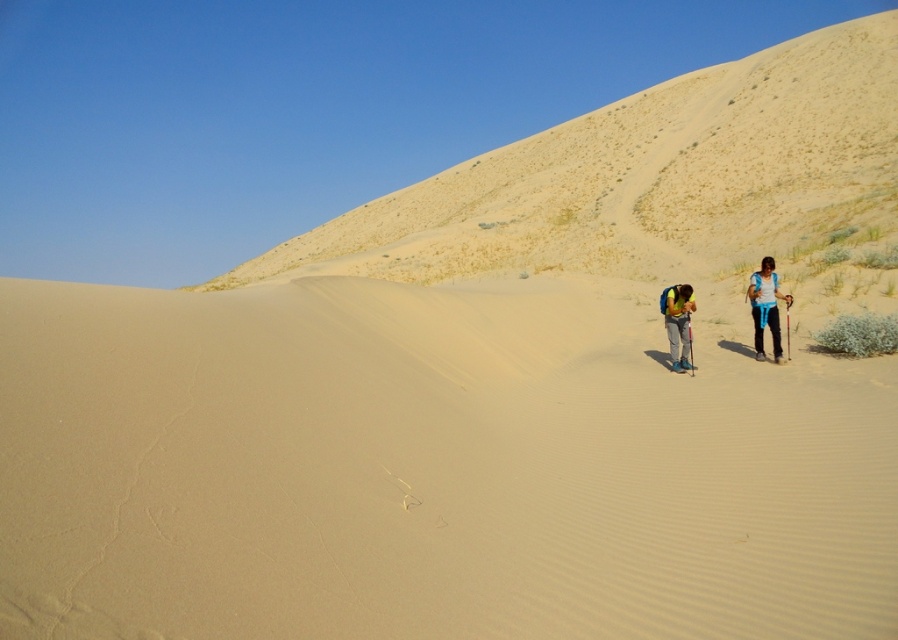
Who is more distant from viewer, (449,616) or (788,298)?

The point (788,298) is more distant.

Who is more forward, (375, 536) or (766, 314)?

Point (375, 536)

Locate an element on the screen. This screenshot has width=898, height=640. smooth sand dune at center is located at coordinates (424, 472).

This screenshot has width=898, height=640. In order to click on smooth sand dune at center in this screenshot , I will do `click(424, 472)`.

Can you confirm if smooth sand dune at center is wider than yellow backpack at center?

Correct, the width of smooth sand dune at center exceeds that of yellow backpack at center.

Does point (151, 454) lie behind point (672, 310)?

No.

Find the location of a particular element. smooth sand dune at center is located at coordinates (424, 472).

Locate an element on the screen. This screenshot has height=640, width=898. smooth sand dune at center is located at coordinates [424, 472].

Does point (814, 566) come closer to viewer compared to point (697, 148)?

That is True.

Identify the location of smooth sand dune at center. pyautogui.click(x=424, y=472).